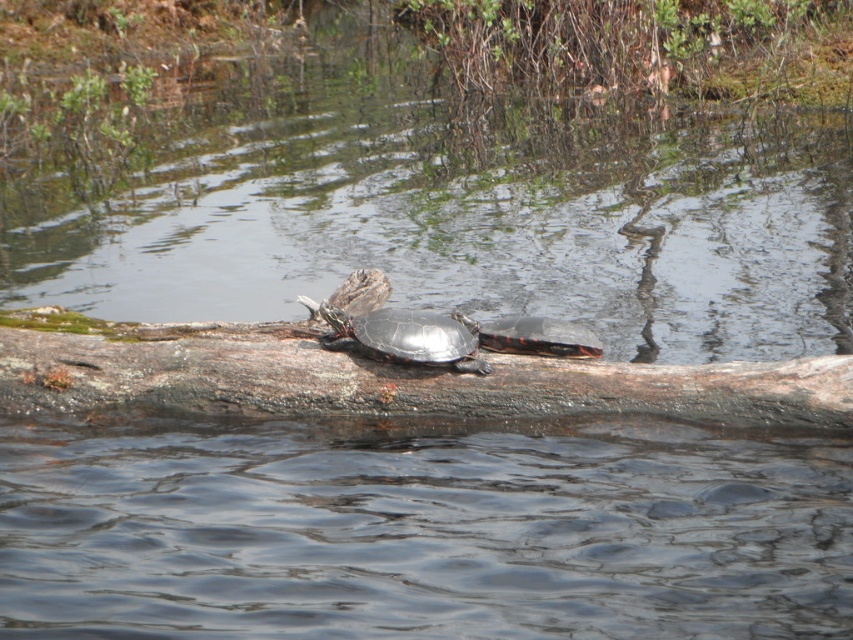
Question: Among these objects, which one is nearest to the camera?

Choices:
 (A) shiny black turtle at center
 (B) smooth brown log at center
 (C) shiny black tortoise at center

Answer: (B)

Question: Can you confirm if shiny black turtle at center is smaller than shiny black tortoise at center?

Choices:
 (A) no
 (B) yes

Answer: (A)

Question: Which of these objects is positioned farthest from the shiny black tortoise at center?

Choices:
 (A) shiny black turtle at center
 (B) smooth brown log at center

Answer: (B)

Question: Which of the following is the closest to the observer?

Choices:
 (A) shiny black tortoise at center
 (B) shiny black turtle at center

Answer: (B)

Question: Is smooth brown log at center wider than shiny black turtle at center?

Choices:
 (A) yes
 (B) no

Answer: (A)

Question: Is shiny black turtle at center bigger than shiny black tortoise at center?

Choices:
 (A) yes
 (B) no

Answer: (A)